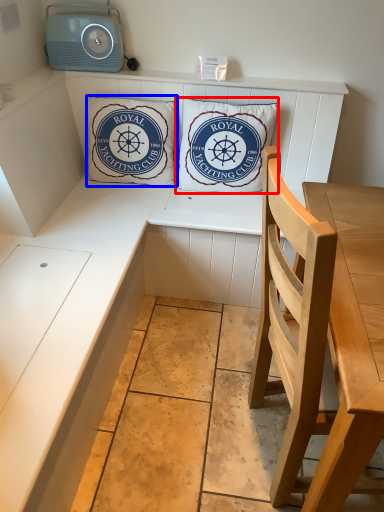
Question: Among these objects, which one is farthest to the camera, pillow (highlighted by a red box) or pillow (highlighted by a blue box)?

Choices:
 (A) pillow
 (B) pillow

Answer: (B)